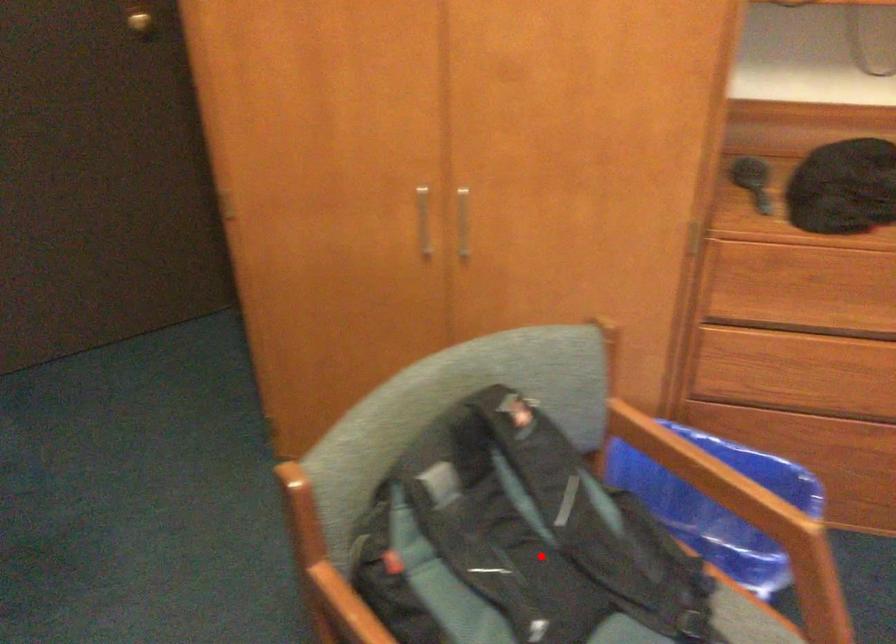
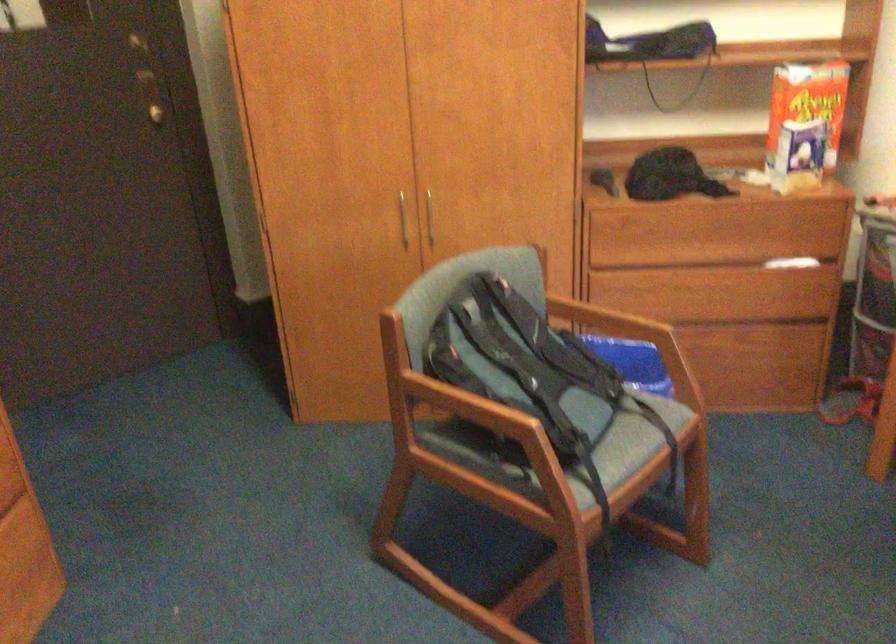
Question: I am providing you with two images of the same scene from different viewpoints. A red point is shown in image1. For the corresponding object point in image2, is it positioned nearer or farther from the camera?

Choices:
 (A) Nearer
 (B) Farther

Answer: (B)